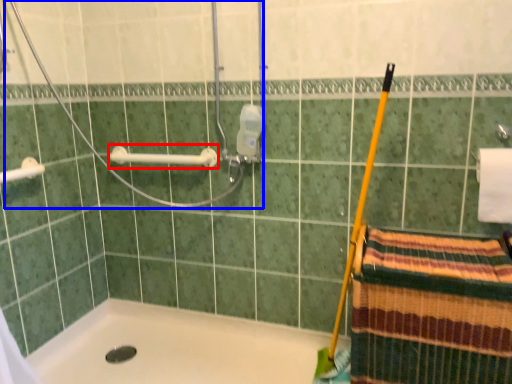
Question: Which object appears closest to the camera in this image, towel bar (highlighted by a red box) or shower (highlighted by a blue box)?

Choices:
 (A) towel bar
 (B) shower

Answer: (B)